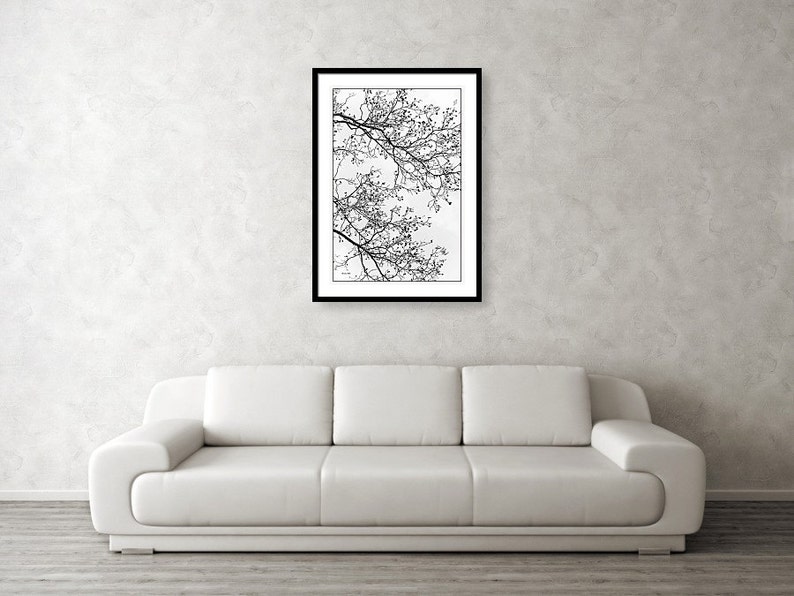
The image size is (794, 596). In order to click on couch cushions in this screenshot , I will do `click(272, 461)`, `click(401, 462)`, `click(506, 462)`.